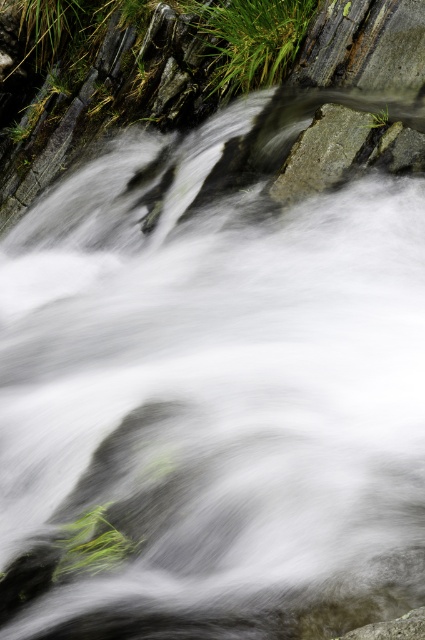
Question: Does green grass at upper center appear over gray rough rock at center?

Choices:
 (A) yes
 (B) no

Answer: (A)

Question: Can you confirm if green grass at upper center is positioned above gray rough rock at center?

Choices:
 (A) yes
 (B) no

Answer: (A)

Question: Which point is closer to the camera?

Choices:
 (A) gray rough rock at center
 (B) green grass at upper center

Answer: (A)

Question: Can you confirm if green grass at upper center is positioned above gray rough rock at center?

Choices:
 (A) no
 (B) yes

Answer: (B)

Question: Which point is closer to the camera?

Choices:
 (A) (241, 19)
 (B) (323, 104)

Answer: (B)